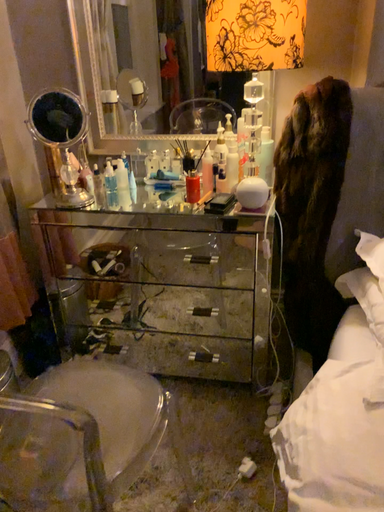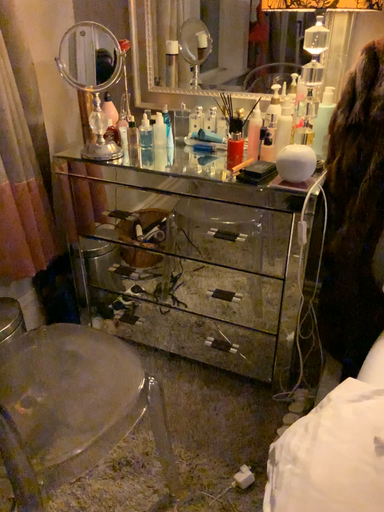
Question: Which way did the camera rotate in the video?

Choices:
 (A) rotated right
 (B) rotated left

Answer: (B)